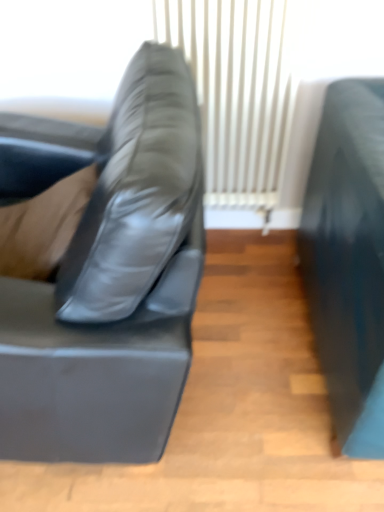
What are the coordinates of `white matte curtain at center` in the screenshot? It's located at (237, 92).

What do you see at coordinates (237, 92) in the screenshot?
I see `white matte curtain at center` at bounding box center [237, 92].

The image size is (384, 512). What do you see at coordinates (114, 289) in the screenshot?
I see `matte black couch at left` at bounding box center [114, 289].

At what (x,y) coordinates should I click in order to perform the action: click on matte black couch at left. Please return your answer as a coordinate pair (x, y). Image resolution: width=384 pixels, height=512 pixels. Looking at the image, I should click on (114, 289).

This screenshot has height=512, width=384. Identify the location of white matte curtain at center. (x=237, y=92).

From the picture: Does matte black couch at left appear on the left side of white matte curtain at center?

Yes, matte black couch at left is to the left of white matte curtain at center.

Which object is further away from the camera taking this photo, matte black couch at left or white matte curtain at center?

Positioned behind is white matte curtain at center.

Is point (166, 269) closer to camera compared to point (223, 40)?

Yes, point (166, 269) is in front of point (223, 40).

From the image's perspective, which object appears higher, matte black couch at left or white matte curtain at center?

white matte curtain at center, from the image's perspective.

From a real-world perspective, is matte black couch at left above or below white matte curtain at center?

matte black couch at left is below white matte curtain at center.

Between matte black couch at left and white matte curtain at center, which one has larger width?

With larger width is matte black couch at left.

Which of these two, matte black couch at left or white matte curtain at center, stands shorter?

With less height is matte black couch at left.

Can you confirm if matte black couch at left is smaller than white matte curtain at center?

Actually, matte black couch at left might be larger than white matte curtain at center.

Is white matte curtain at center completely or partially inside matte black couch at left?

No.

Would you consider matte black couch at left to be distant from white matte curtain at center?

Actually, matte black couch at left and white matte curtain at center are a little close together.

Is matte black couch at left looking in the opposite direction of white matte curtain at center?

matte black couch at left does not have its back to white matte curtain at center.

Based on the photo, can you tell me how much matte black couch at left and white matte curtain at center differ in facing direction?

87.9 degrees.

Measure the distance from matte black couch at left to white matte curtain at center.

matte black couch at left and white matte curtain at center are 26.97 inches apart.

There is a matte black couch at left. Where is `curtain above it (from a real-world perspective)`? The width and height of the screenshot is (384, 512). curtain above it (from a real-world perspective) is located at coordinates (237, 92).

Based on the photo, considering the relative positions of white matte curtain at center and matte black couch at left in the image provided, is white matte curtain at center to the left of matte black couch at left from the viewer's perspective?

Incorrect, white matte curtain at center is not on the left side of matte black couch at left.

In the image, is white matte curtain at center positioned in front of or behind matte black couch at left?

Clearly, white matte curtain at center is behind matte black couch at left.

Which is nearer, [154,14] or [190,197]?

Point [154,14] is farther from the camera than point [190,197].

From the image's perspective, is white matte curtain at center on matte black couch at left?

Yes.

From a real-world perspective, who is located higher, white matte curtain at center or matte black couch at left?

From a 3D spatial view, white matte curtain at center is above.

Does white matte curtain at center have a greater width compared to matte black couch at left?

In fact, white matte curtain at center might be narrower than matte black couch at left.

Considering the relative sizes of white matte curtain at center and matte black couch at left in the image provided, is white matte curtain at center shorter than matte black couch at left?

No.

Is white matte curtain at center smaller than matte black couch at left?

Yes.

Is white matte curtain at center inside the boundaries of matte black couch at left, or outside?

white matte curtain at center is not enclosed by matte black couch at left.

Would you say white matte curtain at center is a long distance from matte black couch at left?

Actually, white matte curtain at center and matte black couch at left are a little close together.

Could you tell me if white matte curtain at center is turned towards matte black couch at left?

No, white matte curtain at center is not facing towards matte black couch at left.

Measure the distance from white matte curtain at center to matte black couch at left.

The distance of white matte curtain at center from matte black couch at left is 26.97 inches.

This screenshot has height=512, width=384. What are the coordinates of `curtain behind the matte black couch at left` in the screenshot? It's located at (237, 92).

Identify the location of curtain lying behind the matte black couch at left. The image size is (384, 512). (237, 92).

I want to click on studio couch on the left of white matte curtain at center, so [x=114, y=289].